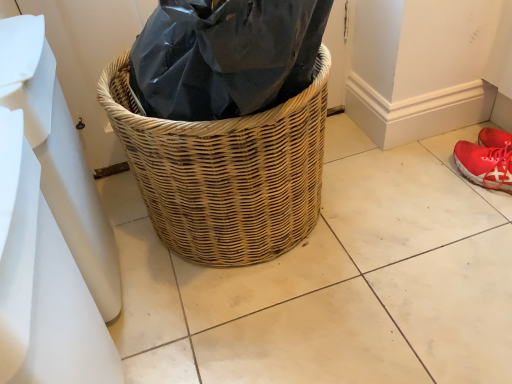
Locate an element on the screen. Image resolution: width=512 pixels, height=384 pixels. free space in front of woven natural basket at center is located at coordinates (300, 339).